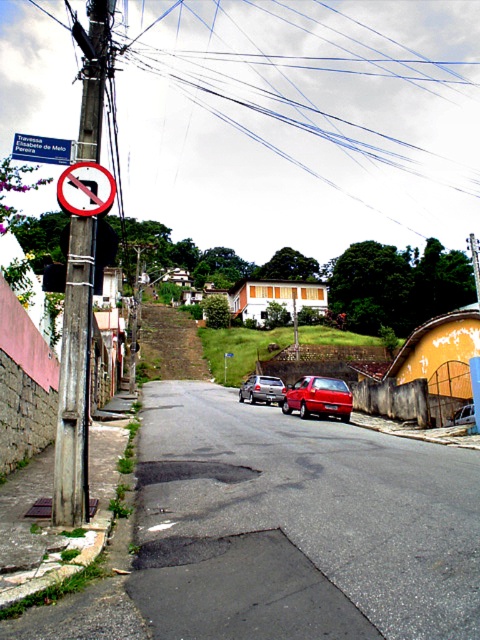
Which is above, blue plastic sign at upper left or metallic silver sedan at center?

Positioned higher is blue plastic sign at upper left.

Looking at this image, is blue plastic sign at upper left in front of metallic silver sedan at center?

Yes, blue plastic sign at upper left is in front of metallic silver sedan at center.

Image resolution: width=480 pixels, height=640 pixels. In order to click on blue plastic sign at upper left in this screenshot , I will do `click(43, 148)`.

Is the position of metallic reflective no parking sign at left less distant than that of blue plastic sign at upper left?

Yes, it is.

Between metallic reflective no parking sign at left and blue plastic sign at upper left, which one has less height?

metallic reflective no parking sign at left

The width and height of the screenshot is (480, 640). What do you see at coordinates (85, 189) in the screenshot?
I see `metallic reflective no parking sign at left` at bounding box center [85, 189].

You are a GUI agent. You are given a task and a screenshot of the screen. Output one action in this format:
    pyautogui.click(x=<x>, y=<y>)
    Task: Click on the metallic reflective no parking sign at left
    
    Given the screenshot: What is the action you would take?
    pyautogui.click(x=85, y=189)

Does smooth gray pole at left have a smaller size compared to shiny red sedan at center?

No, smooth gray pole at left is not smaller than shiny red sedan at center.

Is the position of smooth gray pole at left less distant than that of shiny red sedan at center?

That is True.

Between point (92, 291) and point (320, 381), which one is positioned in front?

Point (92, 291)

Where is `smooth gray pole at left`? Image resolution: width=480 pixels, height=640 pixels. smooth gray pole at left is located at coordinates (74, 380).